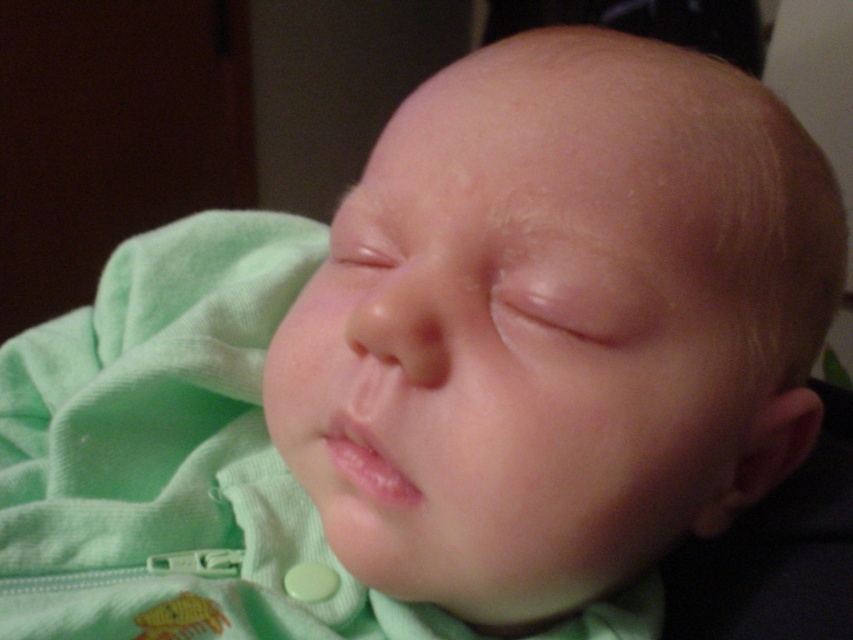
You are a parent holding a baby and want to place the clear plastic teething ring at lower center near the baby. Considering the green soft fabric at center is covering part of the baby, can you place the teething ring in a visible spot without moving the fabric?

The green soft fabric at center is further to the viewer than the clear plastic teething ring at lower center, so the fabric is in front of the teething ring. To place the teething ring in a visible spot without moving the fabric, you would need to position it where the fabric isn not covering it, perhaps to the side or below the fabric.

You are a photographer adjusting your camera to focus on two points in the image of the sleeping baby. The first point is at coordinates point [700,122] and the second is at point [384,483]. Which point should you focus on first if you want to ensure the closest object is in sharp focus?

Point [700,122] is closer to the camera than point [384,483], so you should focus on point [700,122] first to ensure the closest object is in sharp focus.

You are a pediatrician examining a baby. The smooth green baby at center is sleeping and the clear plastic teething ring at lower center is nearby. Which object is taller?

The smooth green baby at center is much taller as clear plastic teething ring at lower center.